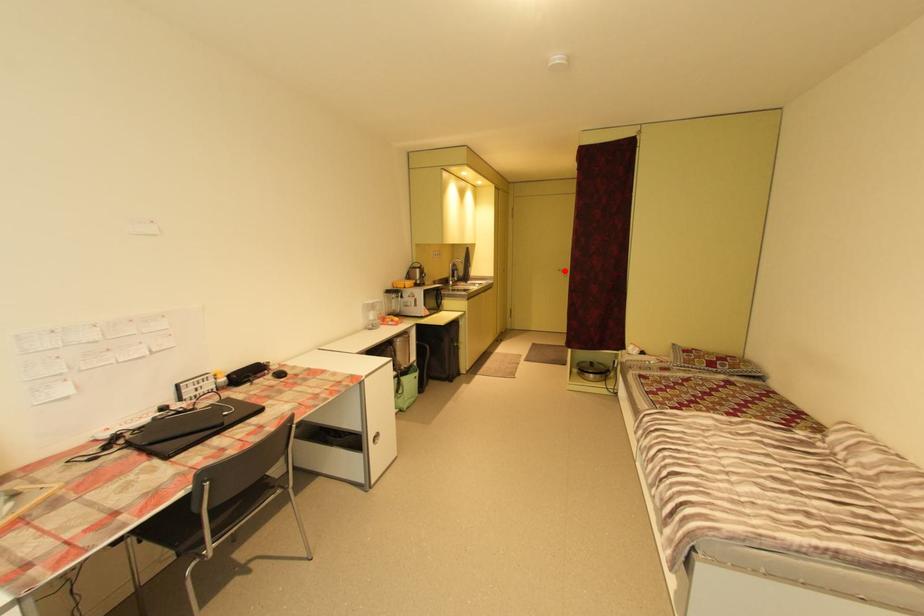
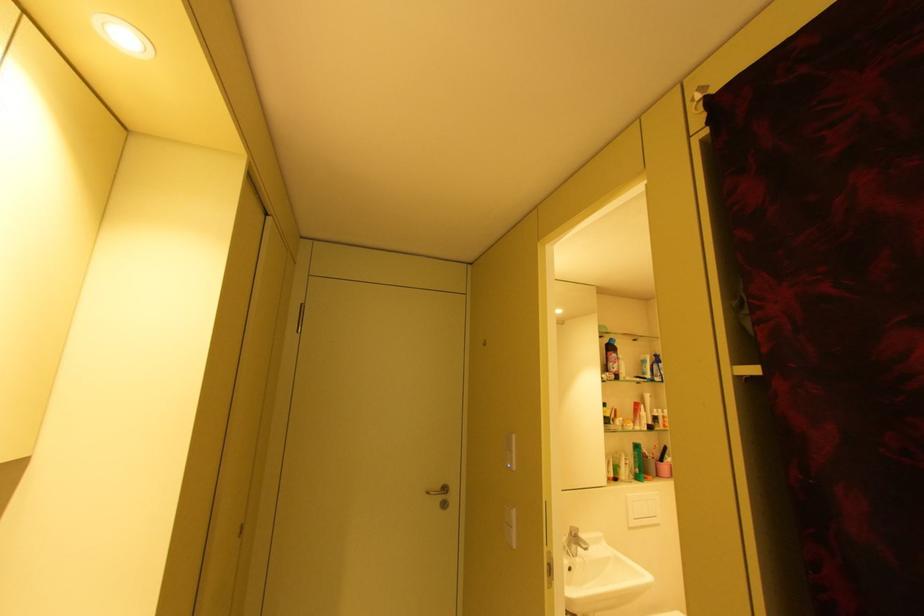
Where in the second image is the point corresponding to the highlighted location from the first image?

(434, 493)